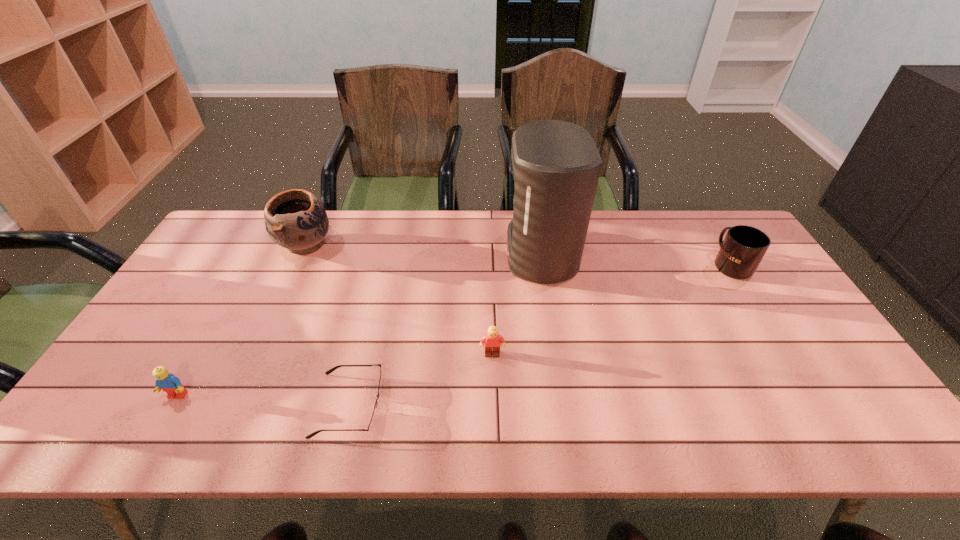
The width and height of the screenshot is (960, 540). What are the coordinates of `vacant space located 0.360m on the front-facing side of the shortest object` in the screenshot? It's located at (537, 405).

This screenshot has width=960, height=540. In order to click on coffee maker situated at the far edge in this screenshot , I will do `click(556, 165)`.

This screenshot has height=540, width=960. Identify the location of pottery present at the far edge. (295, 219).

The height and width of the screenshot is (540, 960). In order to click on mug that is positioned at the far edge in this screenshot , I will do `click(743, 248)`.

I want to click on object at the near edge, so click(372, 423).

Where is `object present at the left edge`? object present at the left edge is located at coordinates (165, 381).

Where is `object that is at the right edge`? object that is at the right edge is located at coordinates coord(743,248).

Image resolution: width=960 pixels, height=540 pixels. What are the coordinates of `object that is at the far right corner` in the screenshot? It's located at (743, 248).

You are a GUI agent. You are given a task and a screenshot of the screen. Output one action in this format:
    pyautogui.click(x=<x>, y=<y>)
    Task: Click on the free location at the far edge
    This screenshot has height=540, width=960.
    Given the screenshot: What is the action you would take?
    pyautogui.click(x=587, y=246)

At what (x,y) coordinates should I click in order to perform the action: click on free space at the near edge of the desktop. Please return your answer as a coordinate pair (x, y). Image resolution: width=960 pixels, height=540 pixels. Looking at the image, I should click on (527, 408).